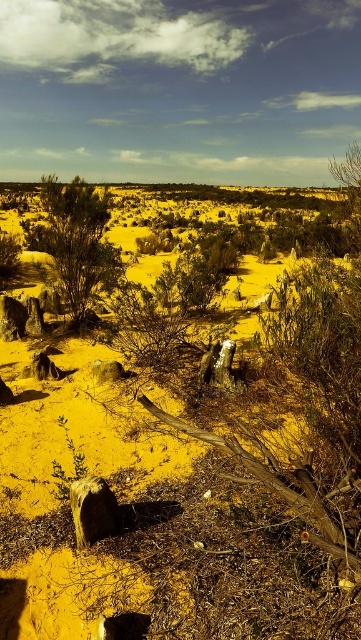
Can you confirm if desert sand at center is positioned to the left of green matte bush at upper left?

Incorrect, desert sand at center is not on the left side of green matte bush at upper left.

Does desert sand at center appear over green matte bush at upper left?

Actually, desert sand at center is below green matte bush at upper left.

Does point (224, 460) come behind point (63, 230)?

That is False.

At what (x,y) coordinates should I click in order to perform the action: click on desert sand at center. Please return your answer as a coordinate pair (x, y). Looking at the image, I should click on (223, 476).